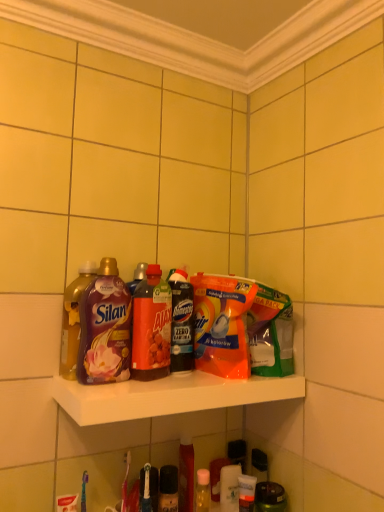
Locate an element on the screen. vacant area that lies to the right of shiny purple bottle at left, marked as the fourth bottle in a right-to-left arrangement is located at coordinates (157, 383).